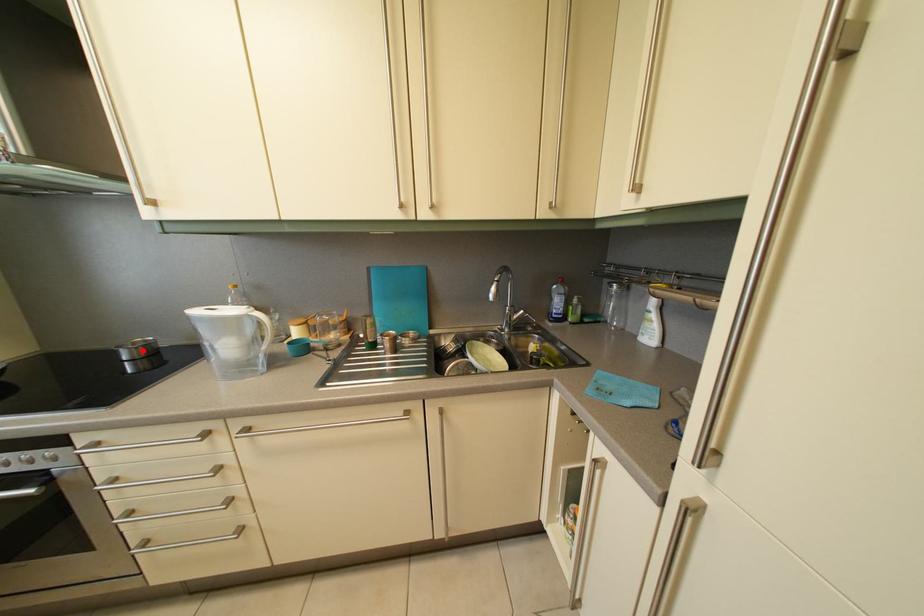
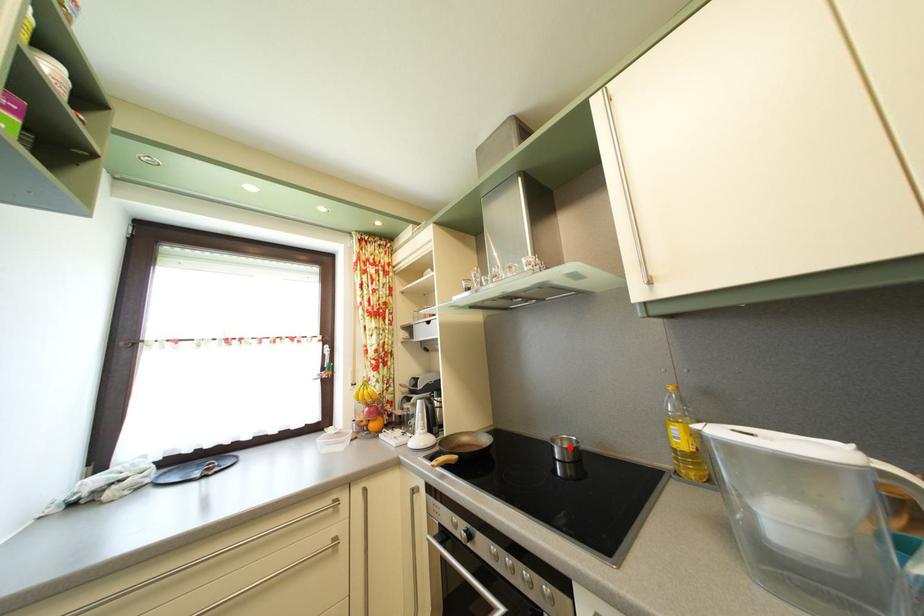
I am providing you with two images of the same scene from different viewpoints. A red point is marked on the first image and another point is marked on the second image. Do the highlighted points in image1 and image2 indicate the same real-world spot?

Yes